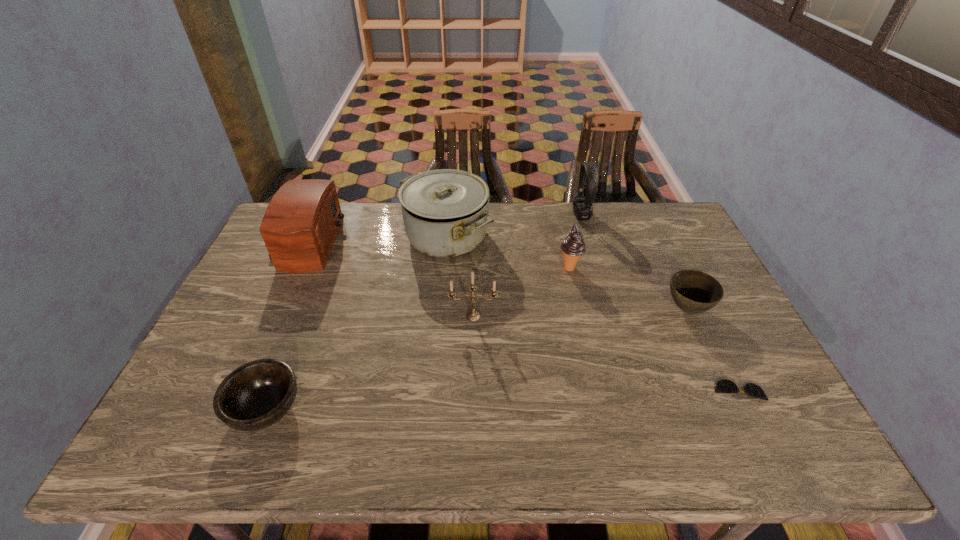
Locate an element on the screen. The image size is (960, 540). vacant space at the near edge is located at coordinates (467, 434).

Image resolution: width=960 pixels, height=540 pixels. In the image, there is a desktop. Find the location of `free space at the left edge`. free space at the left edge is located at coordinates (229, 306).

Image resolution: width=960 pixels, height=540 pixels. Identify the location of blank space at the right edge. (773, 399).

Where is `free space at the far right corner`? free space at the far right corner is located at coordinates (641, 225).

This screenshot has height=540, width=960. I want to click on vacant space at the near right corner of the desktop, so click(x=794, y=422).

Where is `empty space between the nearer bowl and the saucepan`? The height and width of the screenshot is (540, 960). empty space between the nearer bowl and the saucepan is located at coordinates (356, 323).

Where is `free area in between the nearer bowl and the radio receiver`? The width and height of the screenshot is (960, 540). free area in between the nearer bowl and the radio receiver is located at coordinates click(285, 326).

In order to click on unoccupied position between the spectacles and the candle in this screenshot , I will do click(606, 354).

Identify the location of vacant area that lies between the candle and the saucepan. This screenshot has height=540, width=960. (460, 276).

Locate an element on the screen. free space between the icecream and the shortest object is located at coordinates (654, 329).